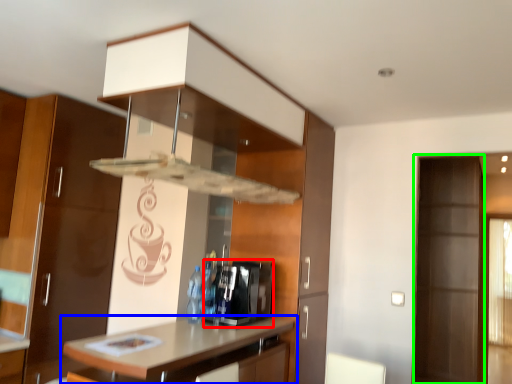
Question: Which object is the closest to the appliance (highlighted by a red box)? Choose among these: countertop (highlighted by a blue box) or screen door (highlighted by a green box).

Choices:
 (A) countertop
 (B) screen door

Answer: (A)